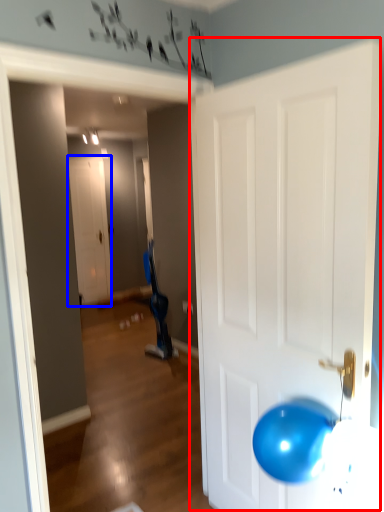
Question: Which object appears farthest to the camera in this image, door (highlighted by a red box) or door (highlighted by a blue box)?

Choices:
 (A) door
 (B) door

Answer: (B)